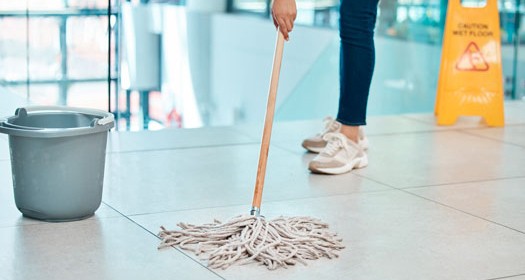
Locate an element on the screen. gray plastic bucket is located at coordinates (60, 167).